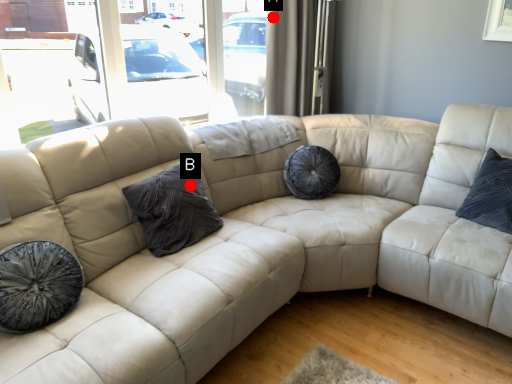
Question: Two points are circled on the image, labeled by A and B beside each circle. Which point is closer to the camera?

Choices:
 (A) A is closer
 (B) B is closer

Answer: (B)